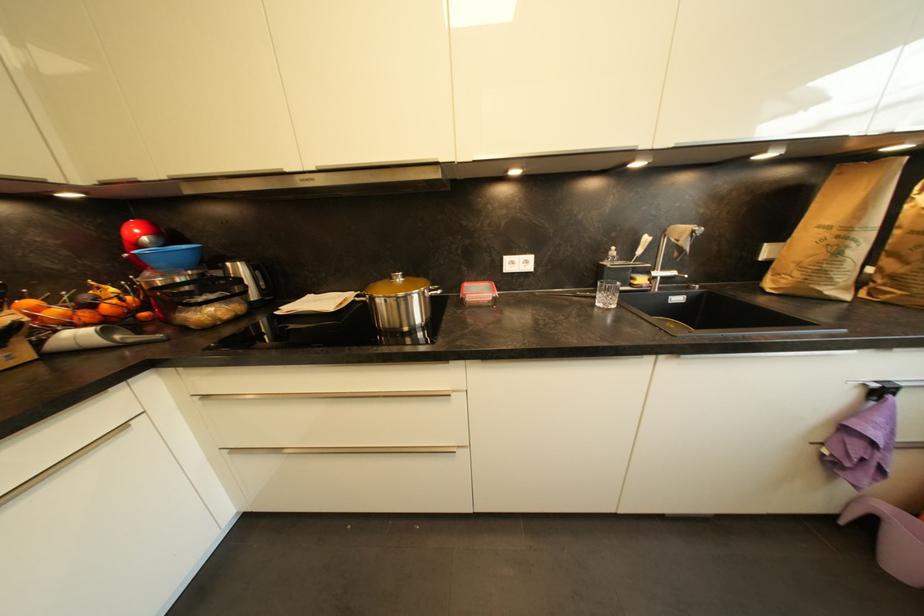
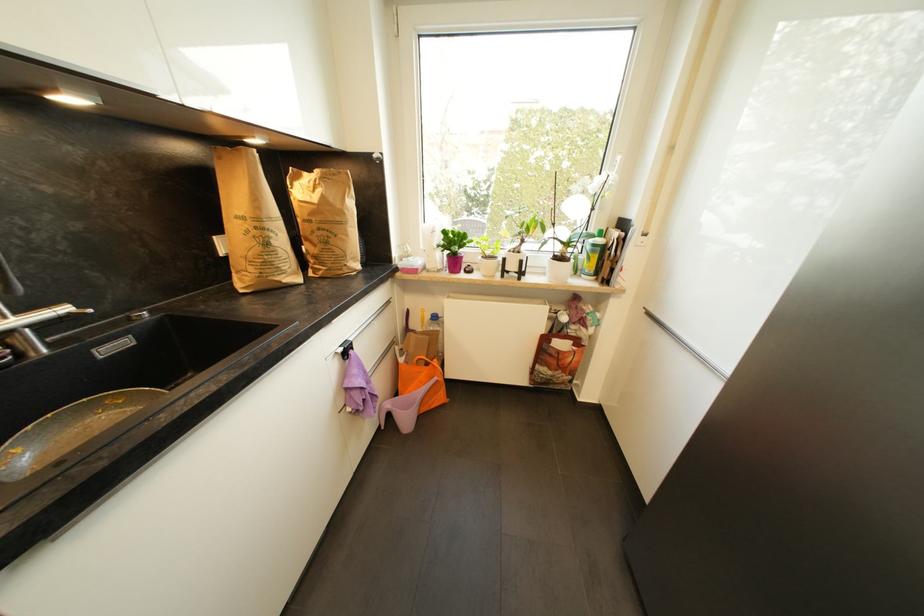
Find the pixel in the second image that matches (880,387) in the first image.

(346, 351)